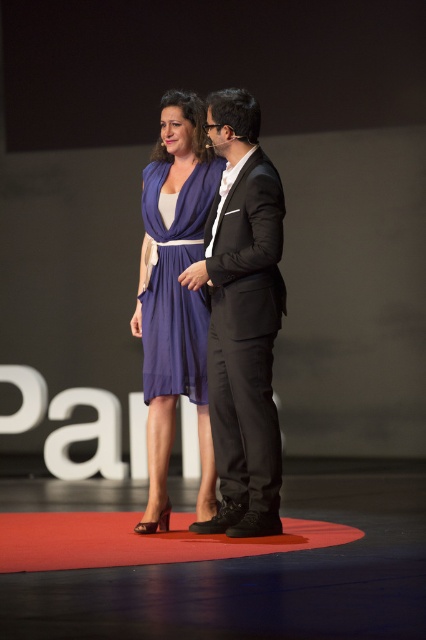
You are an event photographer trying to capture a candid shot of both individuals on stage. You notice two points marked in the scene. The first point is at coordinates point (247, 506) and the second is at point (192, 230). Which point should you focus on to ensure the person closer to the front of the stage is in the frame?

Point (247, 506) is in front of point (192, 230), so focusing on point (247, 506) will ensure the person closer to the front of the stage is captured in the frame.

You are organizing a photo shoot and need to arrange two models wearing the black satin suit at center and the satin purple dress at center. Based on their heights, which model should stand in front to ensure both are visible in the photo?

The model wearing the satin purple dress at center should stand in front since the black satin suit at center is taller. This way, both models will be visible in the photo.